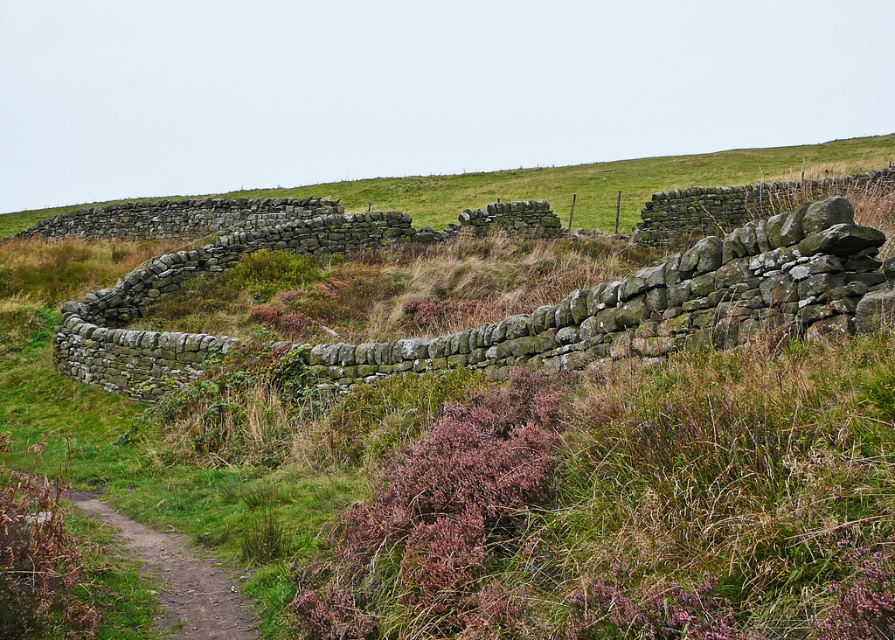
You are a hiker navigating through the rural landscape. You see the green mossy stone wall at center and the rustic stone wall at upper center. Which wall is closer to you?

The green mossy stone wall at center is closer to you as it is positioned in front of the rustic stone wall at upper center.